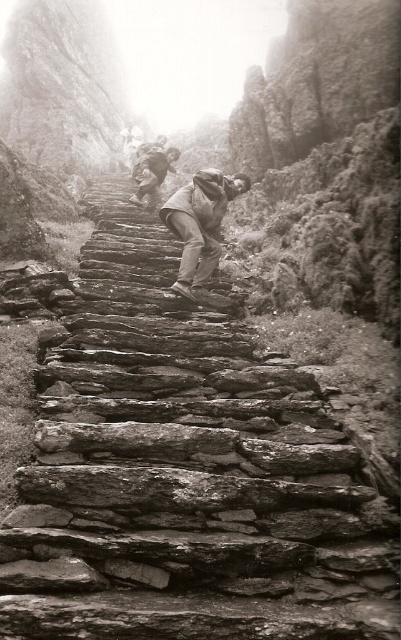
Between rugged brown jacket at center and rugged stone steps at center, which one has less height?

rugged stone steps at center

Does point (220, 182) come farther from viewer compared to point (151, 145)?

No, it is in front of (151, 145).

You are a GUI agent. You are given a task and a screenshot of the screen. Output one action in this format:
    pyautogui.click(x=<x>, y=<y>)
    Task: Click on the rugged brown jacket at center
    The image size is (401, 640).
    Given the screenshot: What is the action you would take?
    pyautogui.click(x=200, y=225)